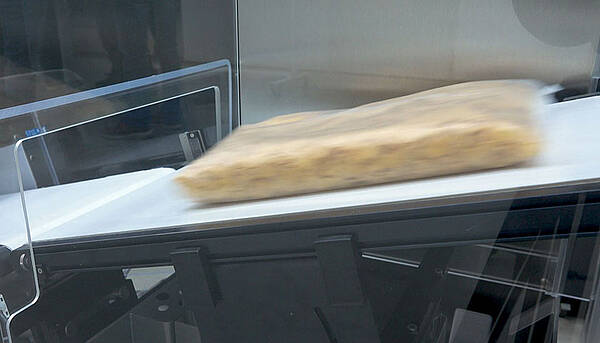
Identify the location of metal frame. The image size is (600, 343). (257, 307), (257, 244), (68, 259), (466, 232).